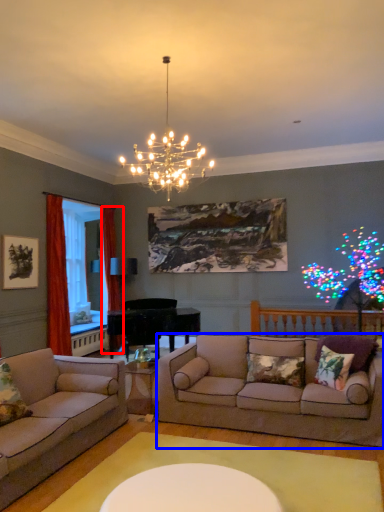
Question: Which object appears farthest to the camera in this image, curtain (highlighted by a red box) or studio couch (highlighted by a blue box)?

Choices:
 (A) curtain
 (B) studio couch

Answer: (A)